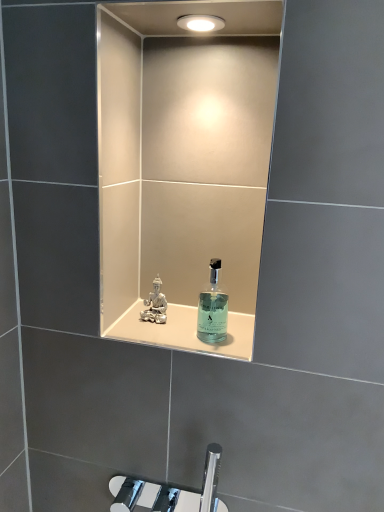
Question: From the image's perspective, is translucent glass bottle at center over transparent glass bottle at center?

Choices:
 (A) yes
 (B) no

Answer: (B)

Question: Is the position of translucent glass bottle at center less distant than that of transparent glass bottle at center?

Choices:
 (A) no
 (B) yes

Answer: (A)

Question: Is translucent glass bottle at center taller than transparent glass bottle at center?

Choices:
 (A) no
 (B) yes

Answer: (A)

Question: Is translucent glass bottle at center oriented towards transparent glass bottle at center?

Choices:
 (A) no
 (B) yes

Answer: (A)

Question: Does translucent glass bottle at center have a larger size compared to transparent glass bottle at center?

Choices:
 (A) no
 (B) yes

Answer: (A)

Question: Would you say translucent glass bottle at center is to the left or to the right of clear glass perfume at center in the picture?

Choices:
 (A) left
 (B) right

Answer: (B)

Question: Considering the positions of point (119, 330) and point (148, 313), is point (119, 330) closer or farther from the camera than point (148, 313)?

Choices:
 (A) closer
 (B) farther

Answer: (A)

Question: Do you think translucent glass bottle at center is within clear glass perfume at center, or outside of it?

Choices:
 (A) outside
 (B) inside

Answer: (A)

Question: Considering their positions, is translucent glass bottle at center located in front of or behind clear glass perfume at center?

Choices:
 (A) front
 (B) behind

Answer: (A)

Question: Is transparent glass bottle at center wider or thinner than clear glass perfume at center?

Choices:
 (A) thin
 (B) wide

Answer: (B)

Question: Which is correct: transparent glass bottle at center is inside clear glass perfume at center, or outside of it?

Choices:
 (A) inside
 (B) outside

Answer: (B)

Question: Based on their positions, is transparent glass bottle at center located to the left or right of clear glass perfume at center?

Choices:
 (A) left
 (B) right

Answer: (B)

Question: Is point pyautogui.click(x=198, y=329) closer or farther from the camera than point pyautogui.click(x=157, y=285)?

Choices:
 (A) farther
 (B) closer

Answer: (B)

Question: Is clear glass perfume at center bigger or smaller than transparent glass bottle at center?

Choices:
 (A) big
 (B) small

Answer: (B)

Question: From the image's perspective, is clear glass perfume at center located above or below transparent glass bottle at center?

Choices:
 (A) above
 (B) below

Answer: (A)